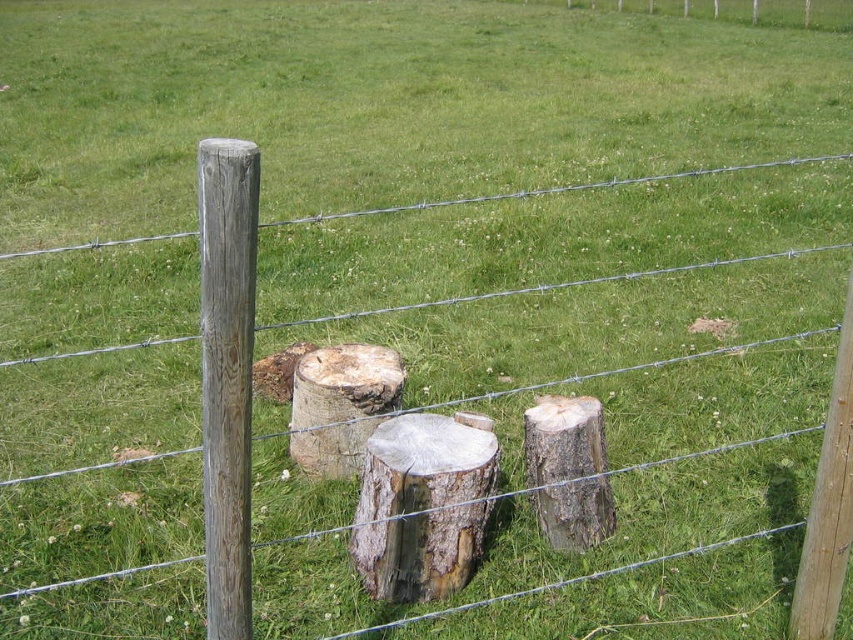
You are standing at the camera position and want to place a 1.5 meter long wooden board between the natural wood stump at center and the camera. Is there enough space to place the board horizontally without bending it?

The distance between the natural wood stump at center and the camera is 4.09 meters, which is greater than the 1.5 meter length of the board. Therefore, there is sufficient space to place the board horizontally without bending it.